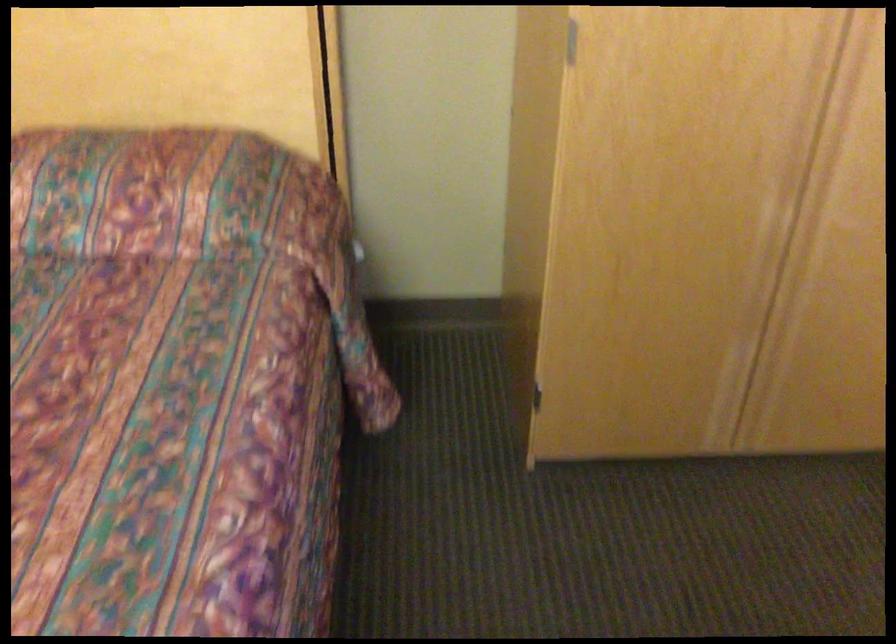
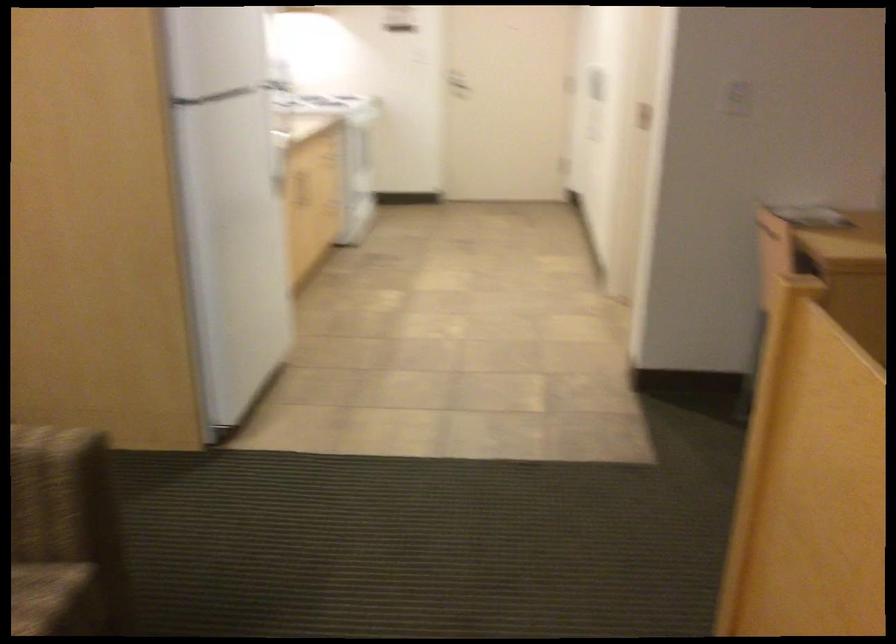
How did the camera likely rotate?

The rotation direction of the camera is left-down.